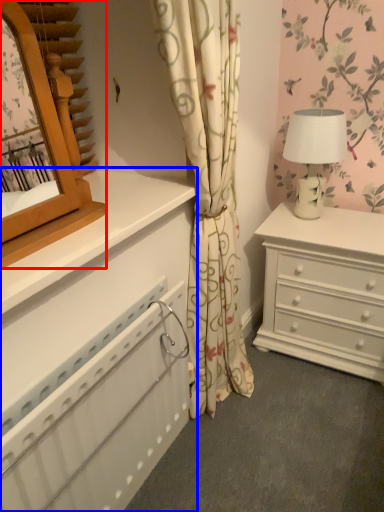
Question: Which point is further to the camera, mirror (highlighted by a red box) or chest of drawers (highlighted by a blue box)?

Choices:
 (A) mirror
 (B) chest of drawers

Answer: (B)